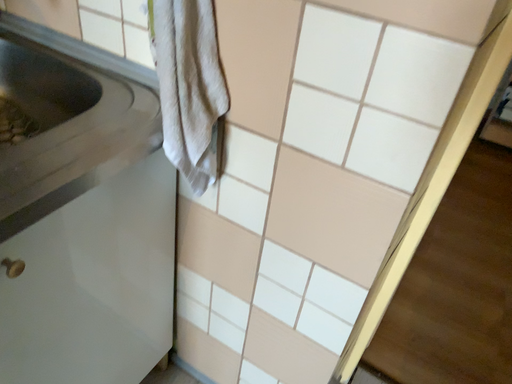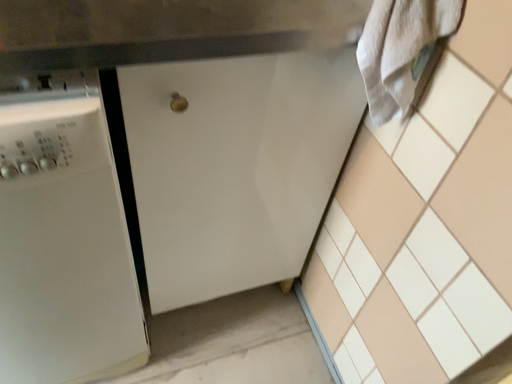
Question: Which way did the camera rotate in the video?

Choices:
 (A) rotated left
 (B) rotated right

Answer: (A)